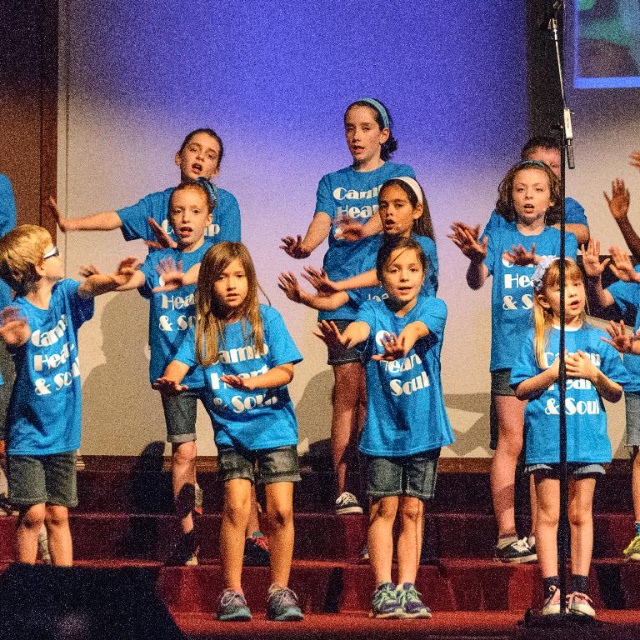
Who is lower down, matte blue t-shirt at center or matte blue t-shirt at left?

matte blue t-shirt at center is below.

What do you see at coordinates (244, 417) in the screenshot? I see `matte blue t-shirt at center` at bounding box center [244, 417].

What are the coordinates of `matte blue t-shirt at center` in the screenshot? It's located at (244, 417).

Consider the image. Does matte blue t-shirt at center appear under matte blue shirt at center?

Yes.

Is matte blue t-shirt at center to the right of matte blue shirt at center from the viewer's perspective?

No, matte blue t-shirt at center is not to the right of matte blue shirt at center.

What are the coordinates of `matte blue t-shirt at center` in the screenshot? It's located at (244, 417).

Is matte blue shirt at center to the left of matte blue t-shirt at left from the viewer's perspective?

No, matte blue shirt at center is not to the left of matte blue t-shirt at left.

Is matte blue shirt at center taller than matte blue t-shirt at left?

Yes.

This screenshot has height=640, width=640. I want to click on matte blue shirt at center, so click(564, 426).